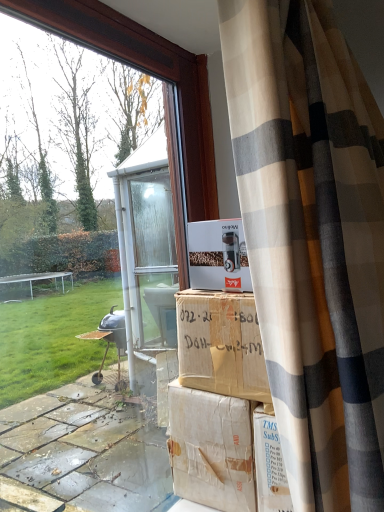
Question: Which direction should I rotate to look at white cardboard box at center, arranged as the 1th cardboard box when viewed from the top?

Choices:
 (A) right
 (B) left

Answer: (A)

Question: Is transparent glass window at center bigger than brown cardboard box at center, the second cardboard box in the top-to-bottom sequence?

Choices:
 (A) yes
 (B) no

Answer: (A)

Question: Is transparent glass window at center oriented towards brown cardboard box at center, the second cardboard box in the top-to-bottom sequence?

Choices:
 (A) yes
 (B) no

Answer: (A)

Question: Is transparent glass window at center outside of brown cardboard box at center, the second cardboard box in the top-to-bottom sequence?

Choices:
 (A) yes
 (B) no

Answer: (A)

Question: Is transparent glass window at center with brown cardboard box at center, the 1th cardboard box in the bottom-to-top sequence?

Choices:
 (A) yes
 (B) no

Answer: (B)

Question: Is transparent glass window at center not near brown cardboard box at center, the 1th cardboard box in the bottom-to-top sequence?

Choices:
 (A) no
 (B) yes

Answer: (A)

Question: Does transparent glass window at center have a lesser height compared to brown cardboard box at center, the second cardboard box in the top-to-bottom sequence?

Choices:
 (A) no
 (B) yes

Answer: (A)

Question: Considering the relative positions of white cardboard box at center, arranged as the 1th cardboard box when viewed from the top, and brown cardboard box at center, the 1th cardboard box in the bottom-to-top sequence, in the image provided, is white cardboard box at center, arranged as the 1th cardboard box when viewed from the top, to the left of brown cardboard box at center, the 1th cardboard box in the bottom-to-top sequence, from the viewer's perspective?

Choices:
 (A) no
 (B) yes

Answer: (A)

Question: Can you confirm if white cardboard box at center, arranged as the 1th cardboard box when viewed from the top, is thinner than brown cardboard box at center, the second cardboard box in the top-to-bottom sequence?

Choices:
 (A) yes
 (B) no

Answer: (A)

Question: Can you confirm if white cardboard box at center, arranged as the 1th cardboard box when viewed from the top, is bigger than brown cardboard box at center, the second cardboard box in the top-to-bottom sequence?

Choices:
 (A) no
 (B) yes

Answer: (A)

Question: From the image's perspective, is white cardboard box at center, arranged as the 1th cardboard box when viewed from the top, under brown cardboard box at center, the 1th cardboard box in the bottom-to-top sequence?

Choices:
 (A) no
 (B) yes

Answer: (A)

Question: From the image's perspective, does white cardboard box at center, arranged as the 1th cardboard box when viewed from the top, appear higher than brown cardboard box at center, the second cardboard box in the top-to-bottom sequence?

Choices:
 (A) no
 (B) yes

Answer: (B)

Question: Is white cardboard box at center, arranged as the 1th cardboard box when viewed from the top, not close to brown cardboard box at center, the second cardboard box in the top-to-bottom sequence?

Choices:
 (A) no
 (B) yes

Answer: (A)

Question: Is brown cardboard box at center, the second cardboard box in the top-to-bottom sequence, placed right next to transparent glass window at center?

Choices:
 (A) yes
 (B) no

Answer: (B)